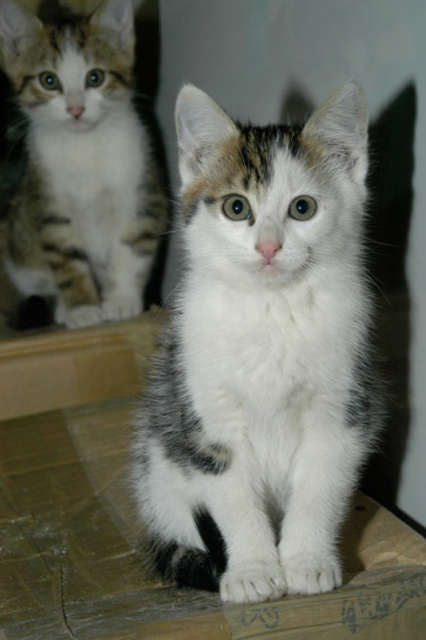
Question: Does white fluffy cat at center appear under white fur cat at center?

Choices:
 (A) yes
 (B) no

Answer: (A)

Question: In this image, where is white fluffy cat at center located relative to white fur cat at center?

Choices:
 (A) below
 (B) above

Answer: (A)

Question: Which of the following is the closest to the observer?

Choices:
 (A) (293, 381)
 (B) (123, 61)

Answer: (A)

Question: Does white fluffy cat at center appear on the right side of white fur cat at center?

Choices:
 (A) no
 (B) yes

Answer: (B)

Question: Which of the following is the farthest from the observer?

Choices:
 (A) (261, 378)
 (B) (94, 278)

Answer: (B)